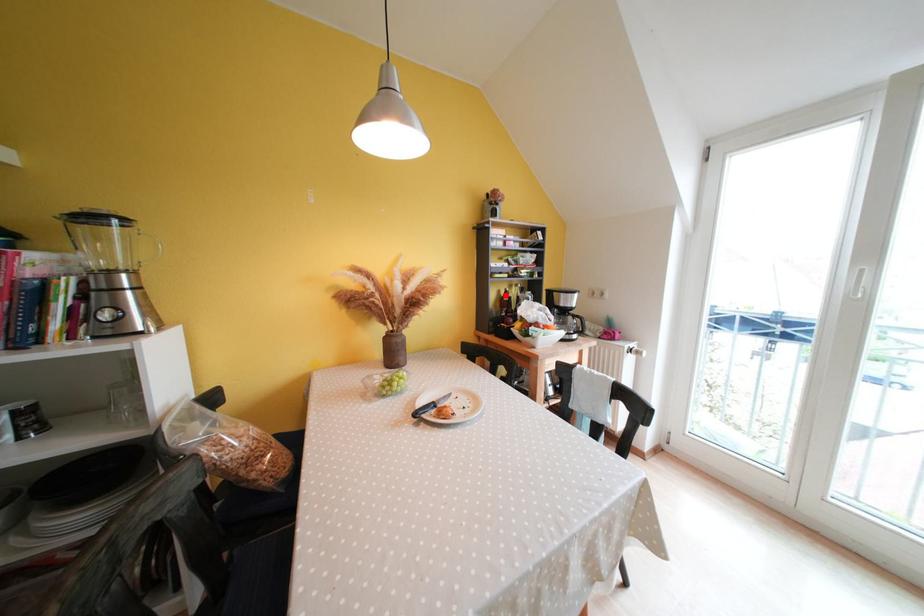
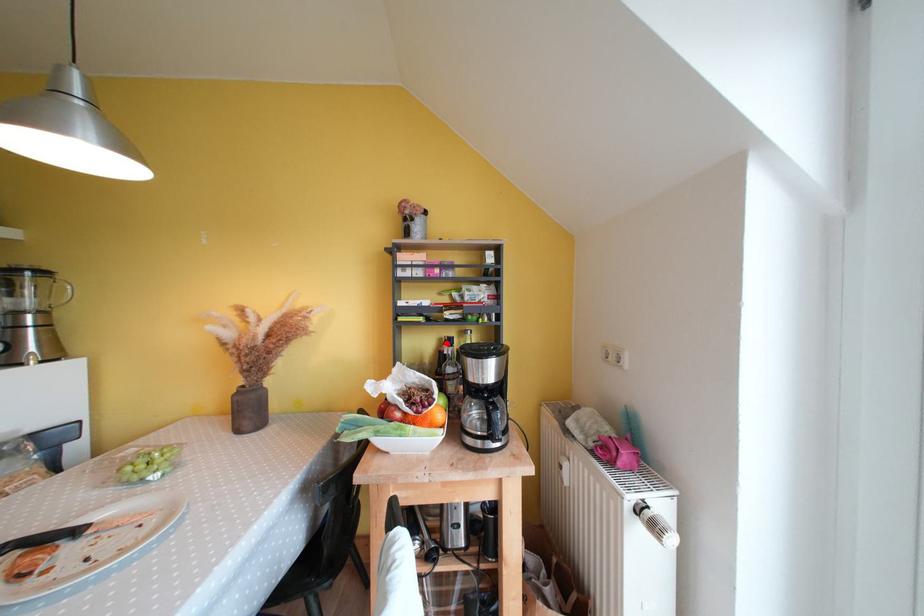
Looking at this image, I am providing you with two images of the same scene from different viewpoints. A red point is marked on the first image and another point is marked on the second image. Is the red point in image1 aligned with the point shown in image2?

Yes